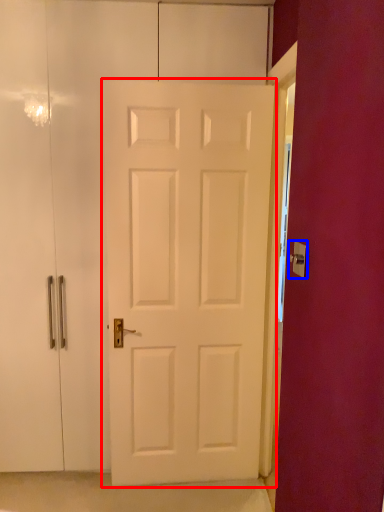
Question: Which object appears farthest to the camera in this image, door (highlighted by a red box) or door handle (highlighted by a blue box)?

Choices:
 (A) door
 (B) door handle

Answer: (A)